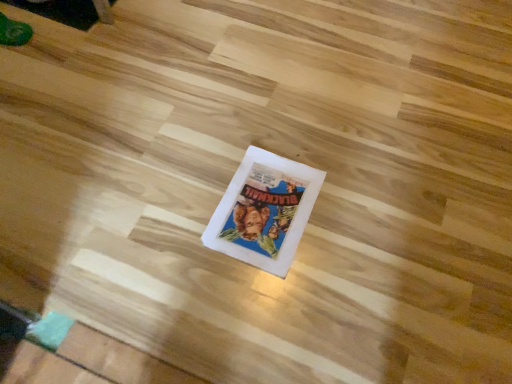
Where is `white paper comic book at center`? This screenshot has width=512, height=384. white paper comic book at center is located at coordinates (264, 211).

Describe the element at coordinates (264, 211) in the screenshot. Image resolution: width=512 pixels, height=384 pixels. I see `white paper comic book at center` at that location.

Find the location of a particular element. The height and width of the screenshot is (384, 512). white paper comic book at center is located at coordinates (264, 211).